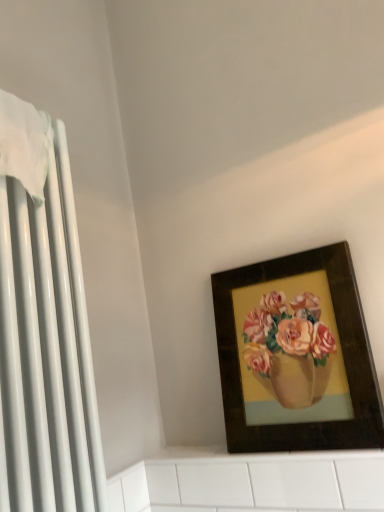
What is the approximate height of wooden picture frame at upper right?

The height of wooden picture frame at upper right is 20.73 inches.

The height and width of the screenshot is (512, 384). What do you see at coordinates (296, 355) in the screenshot? I see `wooden picture frame at upper right` at bounding box center [296, 355].

Image resolution: width=384 pixels, height=512 pixels. Find the location of `wooden picture frame at upper right`. wooden picture frame at upper right is located at coordinates (296, 355).

This screenshot has height=512, width=384. In order to click on white glossy radiator at left in this screenshot , I will do `click(47, 350)`.

What do you see at coordinates (47, 350) in the screenshot? I see `white glossy radiator at left` at bounding box center [47, 350].

At what (x,y) coordinates should I click in order to perform the action: click on wooden picture frame at upper right. Please return your answer as a coordinate pair (x, y). Looking at the image, I should click on pyautogui.click(x=296, y=355).

Which is more to the right, white glossy radiator at left or wooden picture frame at upper right?

wooden picture frame at upper right is more to the right.

Considering their positions, is white glossy radiator at left located in front of or behind wooden picture frame at upper right?

Clearly, white glossy radiator at left is in front of wooden picture frame at upper right.

Which point is more forward, (9, 488) or (267, 446)?

The point (9, 488) is closer.

From the image's perspective, which one is positioned lower, white glossy radiator at left or wooden picture frame at upper right?

wooden picture frame at upper right appears lower in the image.

From a real-world perspective, is white glossy radiator at left physically below wooden picture frame at upper right?

Actually, white glossy radiator at left is physically above wooden picture frame at upper right in the real world.

Considering the relative sizes of white glossy radiator at left and wooden picture frame at upper right in the image provided, is white glossy radiator at left thinner than wooden picture frame at upper right?

Incorrect, the width of white glossy radiator at left is not less than that of wooden picture frame at upper right.

Can you confirm if white glossy radiator at left is taller than wooden picture frame at upper right?

Correct, white glossy radiator at left is much taller as wooden picture frame at upper right.

Considering the sizes of objects white glossy radiator at left and wooden picture frame at upper right in the image provided, who is smaller, white glossy radiator at left or wooden picture frame at upper right?

Smaller between the two is wooden picture frame at upper right.

Can wooden picture frame at upper right be found inside white glossy radiator at left?

Actually, wooden picture frame at upper right is outside white glossy radiator at left.

Is white glossy radiator at left next to wooden picture frame at upper right?

No.

Is white glossy radiator at left aimed at wooden picture frame at upper right?

No, white glossy radiator at left is not turned towards wooden picture frame at upper right.

Can you tell me how much white glossy radiator at left and wooden picture frame at upper right differ in facing direction?

The angle between the facing direction of white glossy radiator at left and the facing direction of wooden picture frame at upper right is 91.2 degrees.

How distant is white glossy radiator at left from wooden picture frame at upper right?

white glossy radiator at left is 18.61 inches from wooden picture frame at upper right.

This screenshot has width=384, height=512. What are the coordinates of `radiator in front of the wooden picture frame at upper right` in the screenshot? It's located at (47, 350).

Considering the relative positions of wooden picture frame at upper right and white glossy radiator at left in the image provided, is wooden picture frame at upper right to the left or to the right of white glossy radiator at left?

Clearly, wooden picture frame at upper right is on the right of white glossy radiator at left in the image.

Is the position of wooden picture frame at upper right more distant than that of white glossy radiator at left?

Yes.

Which is closer to the camera, (245, 284) or (8, 487)?

The point (8, 487) is in front.

From the image's perspective, which is above, wooden picture frame at upper right or white glossy radiator at left?

white glossy radiator at left is shown above in the image.

From a real-world perspective, is wooden picture frame at upper right physically located above or below white glossy radiator at left?

In terms of real-world spatial position, wooden picture frame at upper right is below white glossy radiator at left.

Can you confirm if wooden picture frame at upper right is wider than white glossy radiator at left?

No, wooden picture frame at upper right is not wider than white glossy radiator at left.

Can you confirm if wooden picture frame at upper right is shorter than white glossy radiator at left?

Correct, wooden picture frame at upper right is not as tall as white glossy radiator at left.

Does wooden picture frame at upper right have a smaller size compared to white glossy radiator at left?

Indeed, wooden picture frame at upper right has a smaller size compared to white glossy radiator at left.

Is wooden picture frame at upper right spatially inside white glossy radiator at left, or outside of it?

wooden picture frame at upper right is not enclosed by white glossy radiator at left.

Can you see wooden picture frame at upper right touching white glossy radiator at left?

No.

From the picture: Is wooden picture frame at upper right facing away from white glossy radiator at left?

No, wooden picture frame at upper right is not facing away from white glossy radiator at left.

How different are the orientations of wooden picture frame at upper right and white glossy radiator at left in degrees?

91.2 degrees.

Locate an element on the screen. The width and height of the screenshot is (384, 512). picture frame below the white glossy radiator at left (from a real-world perspective) is located at coordinates (296, 355).

Find the location of `picture frame below the white glossy radiator at left (from the image's perspective)`. picture frame below the white glossy radiator at left (from the image's perspective) is located at coordinates (296, 355).

The image size is (384, 512). Identify the location of picture frame on the right side of white glossy radiator at left. (296, 355).